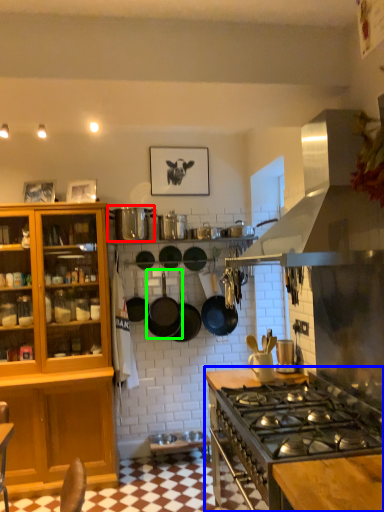
Question: Based on their relative distances, which object is nearer to appliance (highlighted by a red box)? Choose from countertop (highlighted by a blue box) and wok (highlighted by a green box).

Choices:
 (A) countertop
 (B) wok

Answer: (B)